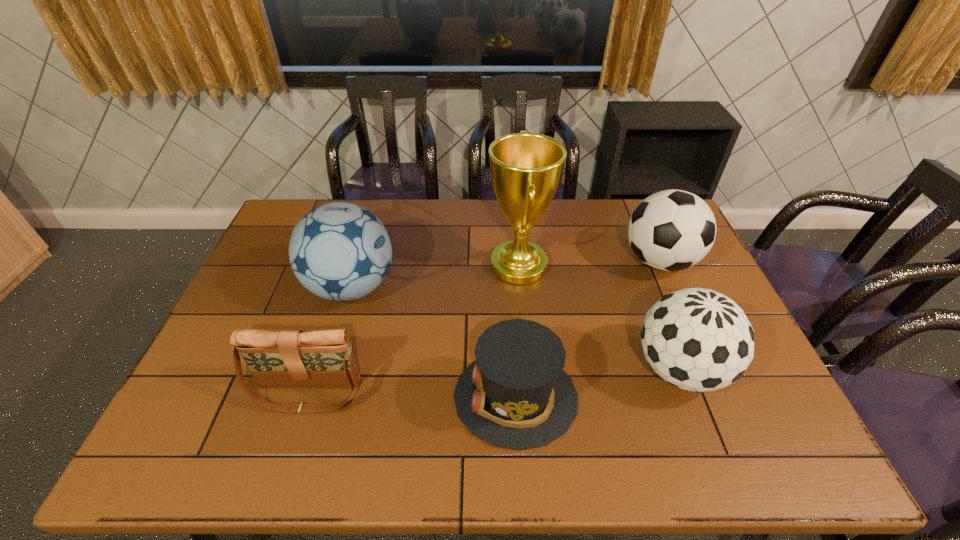
Locate an element on the screen. The width and height of the screenshot is (960, 540). vacant space located 0.120m on the front-facing side of the shoulder bag is located at coordinates (285, 464).

What are the coordinates of `free space located with goggles on the front of the dress hat` in the screenshot? It's located at (353, 397).

In order to click on free space located with goggles on the front of the dress hat in this screenshot , I will do `click(348, 397)`.

Locate an element on the screen. vacant space located with goggles on the front of the dress hat is located at coordinates (414, 397).

I want to click on award that is at the far edge, so click(526, 168).

Find the location of a particular element. This screenshot has height=540, width=960. soccer ball situated at the far edge is located at coordinates (671, 230).

At what (x,y) coordinates should I click in order to perform the action: click on object present at the near edge. Please return your answer as a coordinate pair (x, y). Looking at the image, I should click on (516, 395).

In order to click on object that is at the left edge in this screenshot , I will do `click(287, 358)`.

The height and width of the screenshot is (540, 960). I want to click on object located in the far right corner section of the desktop, so click(x=671, y=230).

The width and height of the screenshot is (960, 540). I want to click on vacant space at the far edge of the desktop, so click(x=483, y=239).